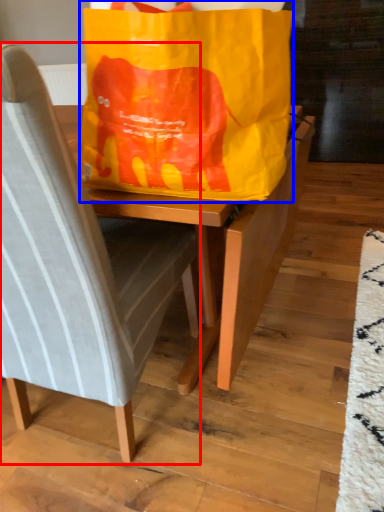
Question: Which of the following is the closest to the observer, chair (highlighted by a red box) or grocery bag (highlighted by a blue box)?

Choices:
 (A) chair
 (B) grocery bag

Answer: (A)